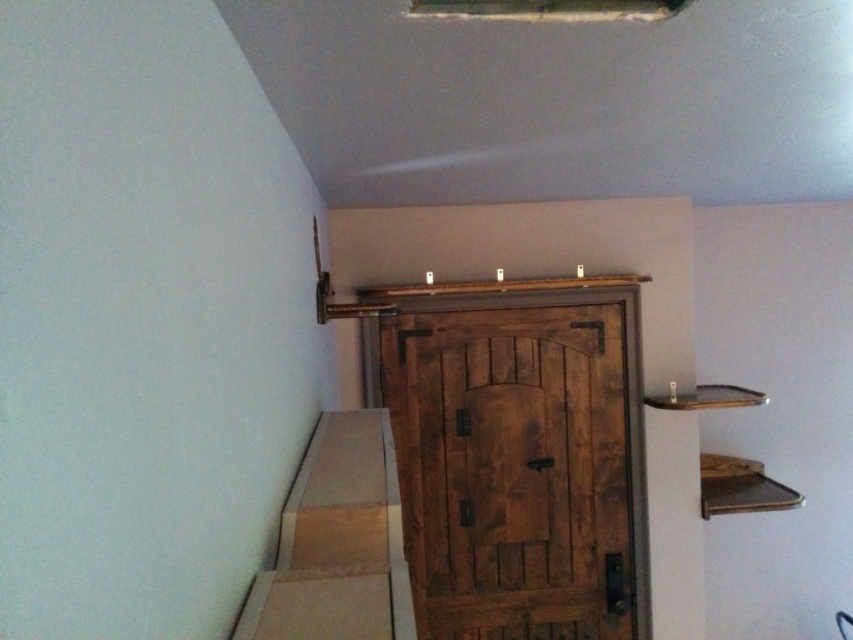
Locate an element on the screen. rustic wood door at center is located at coordinates (520, 468).

Between rustic wood door at center and wooden stairs at lower center, which one has less height?

wooden stairs at lower center is shorter.

The width and height of the screenshot is (853, 640). Describe the element at coordinates (520, 468) in the screenshot. I see `rustic wood door at center` at that location.

The image size is (853, 640). I want to click on rustic wood door at center, so click(x=520, y=468).